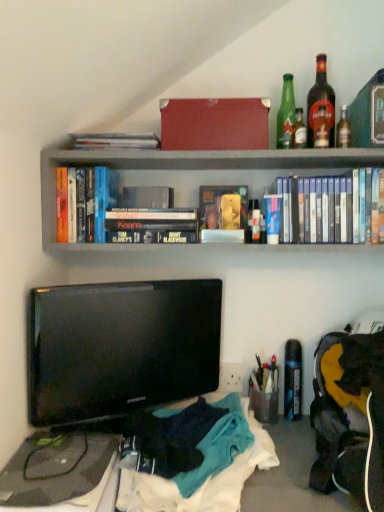
Where is `free point above black plastic desktop at lower left (from a real-world perspective)`? The image size is (384, 512). free point above black plastic desktop at lower left (from a real-world perspective) is located at coordinates (69, 450).